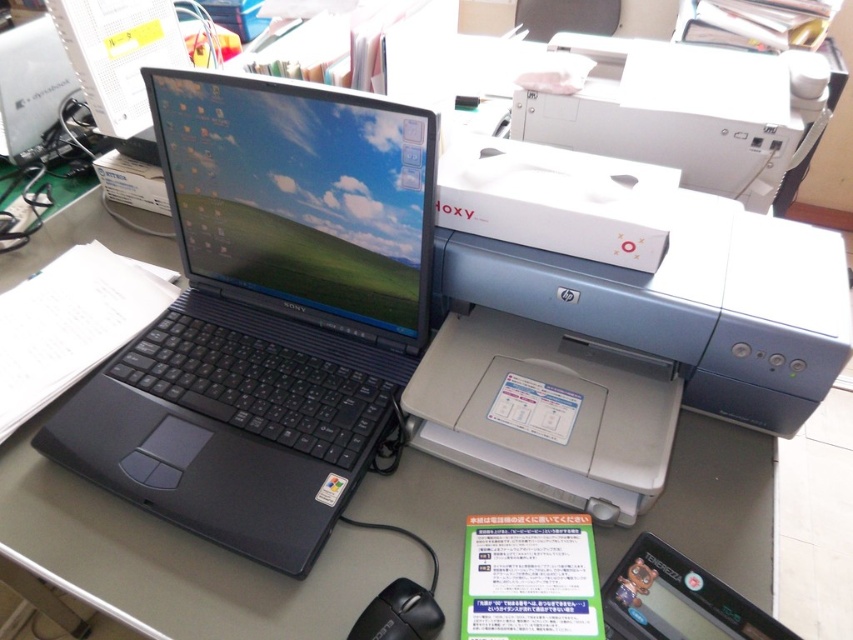
Question: Among these points, which one is farthest from the camera?

Choices:
 (A) (283, 477)
 (B) (231, 604)
 (C) (148, 6)

Answer: (C)

Question: Is black matte laptop at center further to the viewer compared to matte black laptop at left?

Choices:
 (A) no
 (B) yes

Answer: (B)

Question: Is satin silver printer at center below white glossy printer at upper right?

Choices:
 (A) yes
 (B) no

Answer: (A)

Question: Observing the image, what is the correct spatial positioning of black matte laptop at center in reference to matte black laptop at upper left?

Choices:
 (A) right
 (B) left

Answer: (A)

Question: Which is nearer to the white glossy printer at upper right?

Choices:
 (A) matte black laptop at left
 (B) black matte laptop at center
 (C) satin silver printer at center
 (D) black plastic mouse at lower center

Answer: (C)

Question: Which of the following is the closest to the observer?

Choices:
 (A) (482, 193)
 (B) (161, 433)
 (C) (86, 237)

Answer: (A)